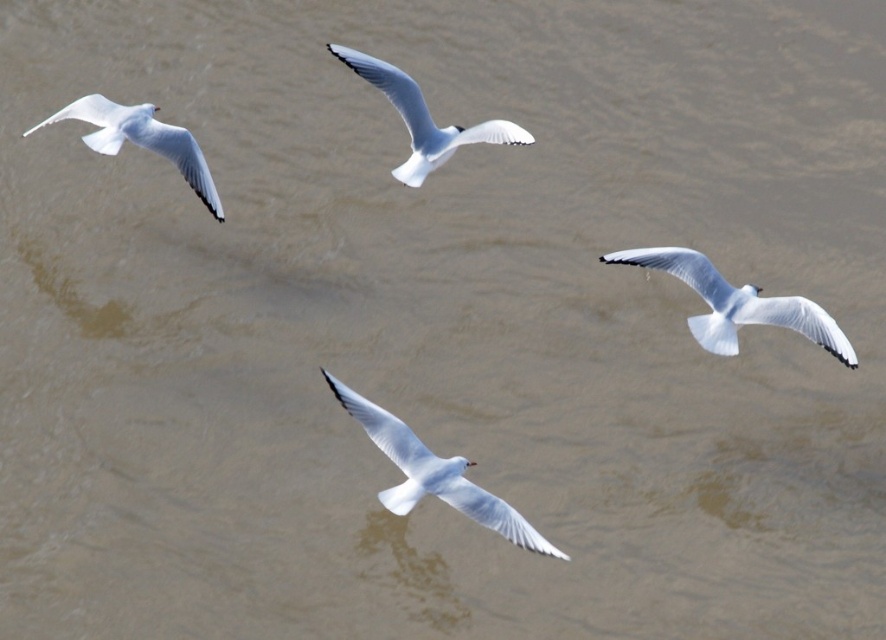
Question: Among these points, which one is farthest from the camera?

Choices:
 (A) (418, 493)
 (B) (162, 131)

Answer: (B)

Question: Considering the relative positions of white matte bird at center and white matte seagull at upper left in the image provided, where is white matte bird at center located with respect to white matte seagull at upper left?

Choices:
 (A) right
 (B) left

Answer: (A)

Question: Which point is closer to the camera?

Choices:
 (A) white matte seagull at upper left
 (B) white matte bird at center

Answer: (B)

Question: Is white matte seagull at lower right smaller than white matte seagull at upper left?

Choices:
 (A) yes
 (B) no

Answer: (A)

Question: Which point is farther to the camera?

Choices:
 (A) (843, 342)
 (B) (148, 141)
 (C) (455, 493)

Answer: (B)

Question: Does white matte seagull at lower right have a larger size compared to white matte seagull at upper left?

Choices:
 (A) yes
 (B) no

Answer: (B)